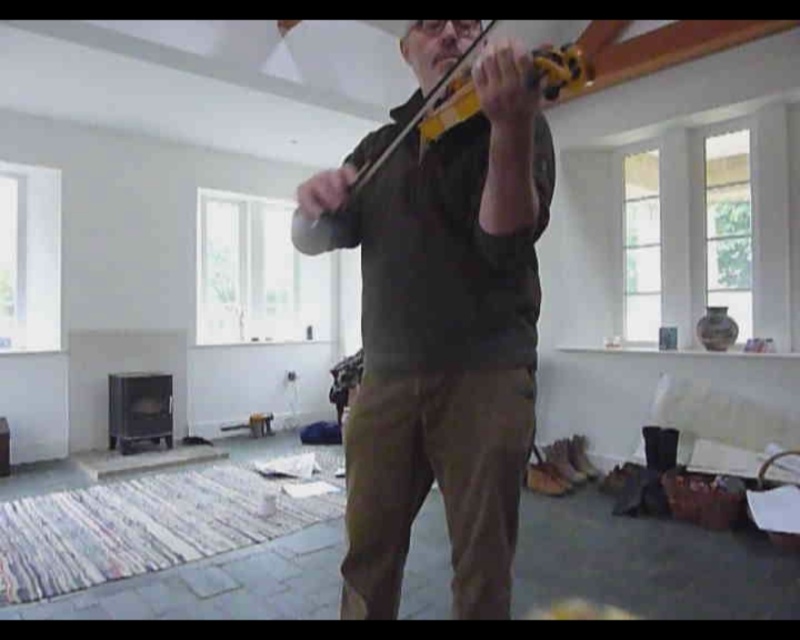
You are a music teacher observing a student holding two violins, the matte black violin at center and the yellow matte violin at center. Which violin should the student choose if they need a larger instrument for a performance?

The student should choose the matte black violin at center because it has a larger size compared to the yellow matte violin at center.

You are a photographer setting up for a music session in the living room. You need to position a light source to the right of both the matte black violin at center and the yellow matte violin at center. Which violin should you place the light closer to, the one on the left or the right?

The light should be placed closer to the yellow matte violin at center because the matte black violin at center is to the left of it, meaning the yellow matte violin at center is on the right side.

You are a music teacher observing a student playing two violins simultaneously. The student is holding the matte black violin at center with their left hand and the yellow matte violin at center with their right hand. Which violin requires a wider grip due to its size?

The matte black violin at center requires a wider grip because its width surpasses that of the yellow matte violin at center.